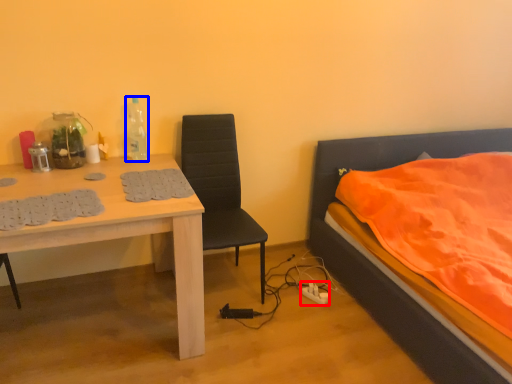
Question: Which object is closer to the camera taking this photo, power outlet (highlighted by a red box) or bottle (highlighted by a blue box)?

Choices:
 (A) power outlet
 (B) bottle

Answer: (B)